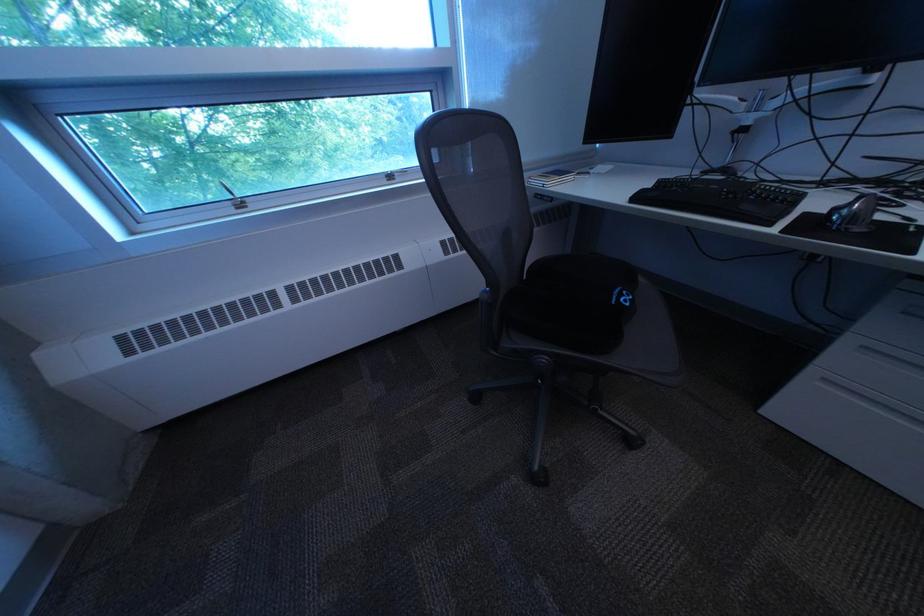
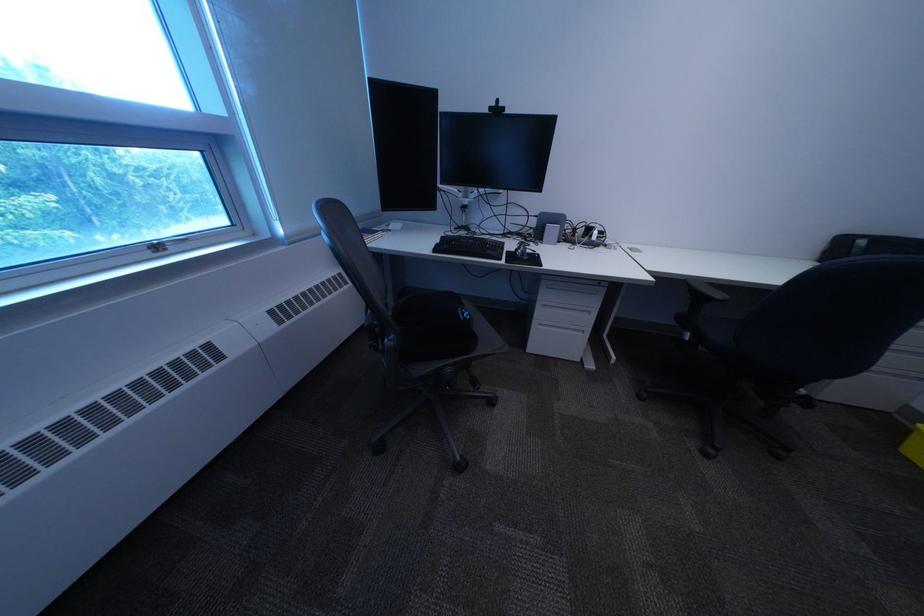
Where in the second image is the point corresponding to point (650, 200) from the first image?

(451, 252)